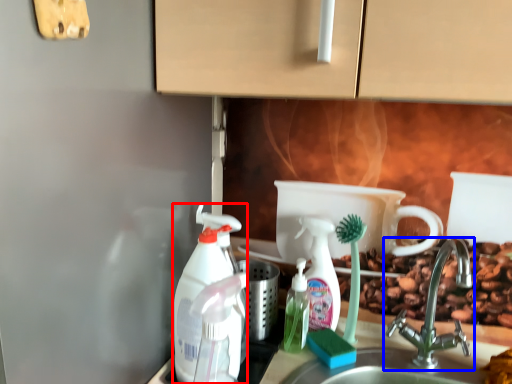
Question: Among these objects, which one is farthest to the camera, cleaning product (highlighted by a red box) or tap (highlighted by a blue box)?

Choices:
 (A) cleaning product
 (B) tap

Answer: (A)